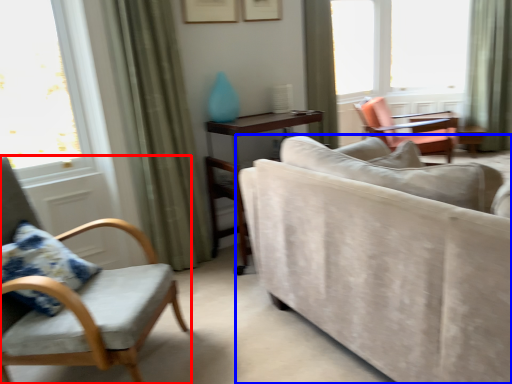
Question: Which point is further to the camera, chair (highlighted by a red box) or studio couch (highlighted by a blue box)?

Choices:
 (A) chair
 (B) studio couch

Answer: (A)